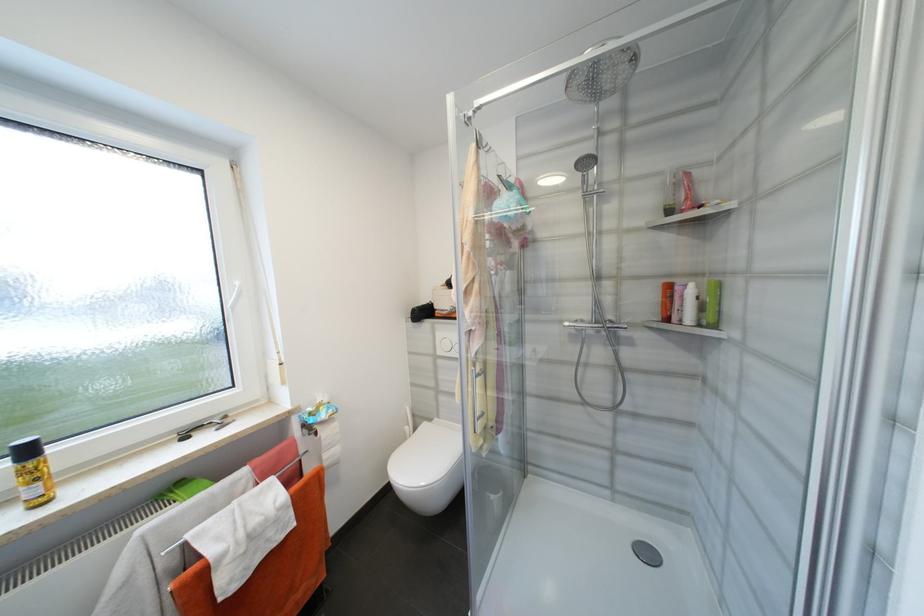
Find where to pull the toilet paper roll. Please return your answer as a coordinate pair (x, y).

(329, 440)